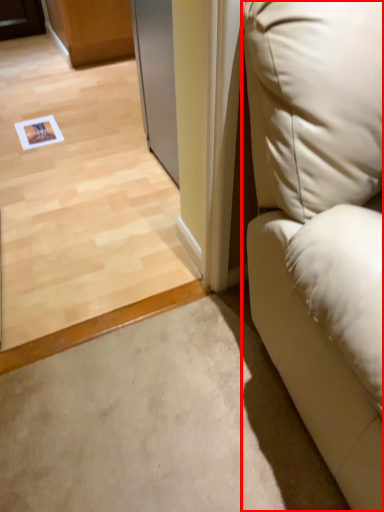
Question: In this image, where is furniture (annotated by the red box) located relative to screen door?

Choices:
 (A) left
 (B) right

Answer: (B)